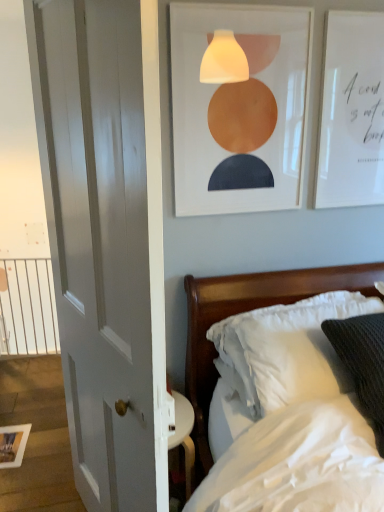
Locate an element on the screen. vacant point above white soft pillow at lower right (from a real-world perspective) is located at coordinates (278, 320).